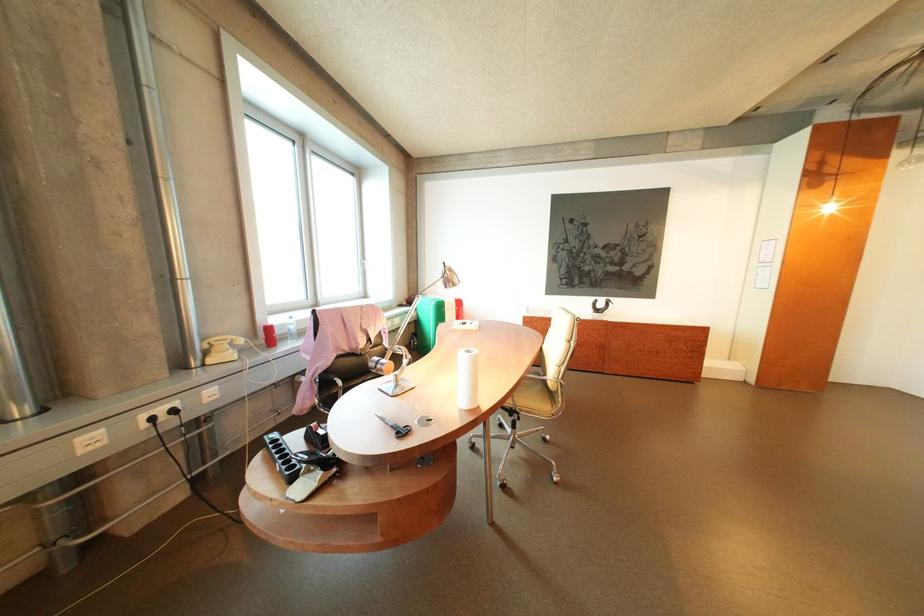
Where would you resting arm the white chair armrest? Please return your answer as a coordinate pair (x, y).

(532, 376)